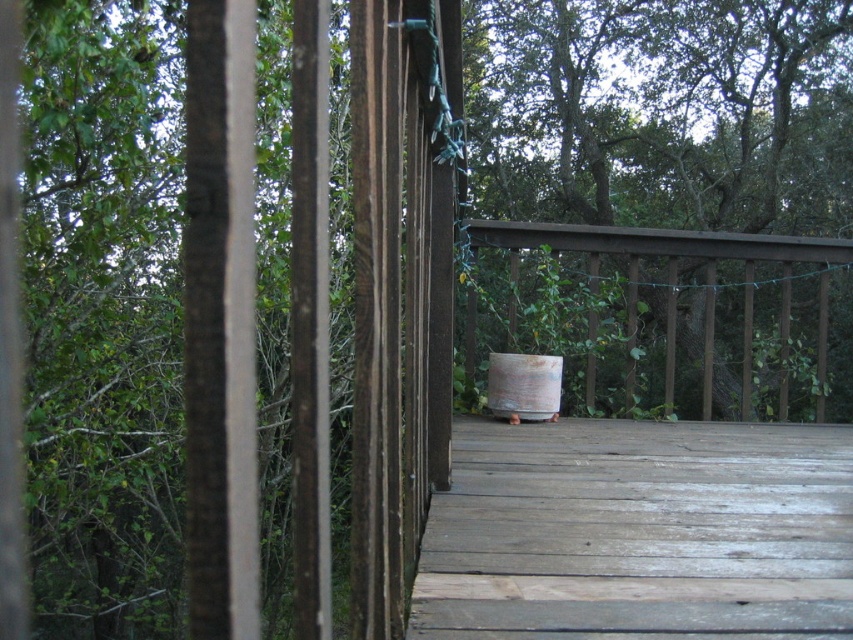
You are planning to place a new small potted plant on the wooden deck. The deck has a white ceramic pot at center and a rusty metal barrel at center. Which object can you place the potted plant on top of, considering their sizes?

The white ceramic pot at center is larger in size than the rusty metal barrel at center, so the potted plant can be placed on top of the white ceramic pot at center since it has a larger surface area.